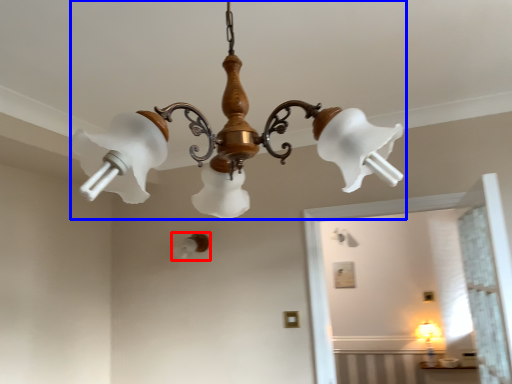
Question: Which point is further to the camera, lamp (highlighted by a red box) or lamp (highlighted by a blue box)?

Choices:
 (A) lamp
 (B) lamp

Answer: (A)